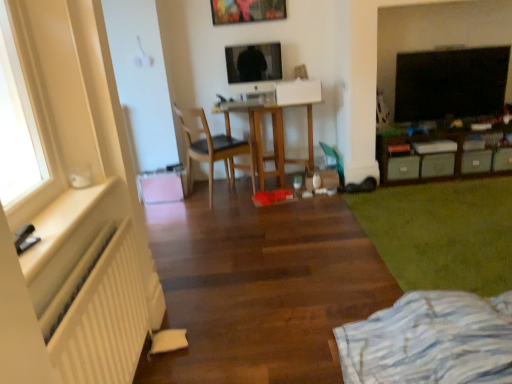
Find the location of a particular element. free space in front of gray matte drawer at lower right, which ranks as the 2th drawer in left-to-right order is located at coordinates (448, 184).